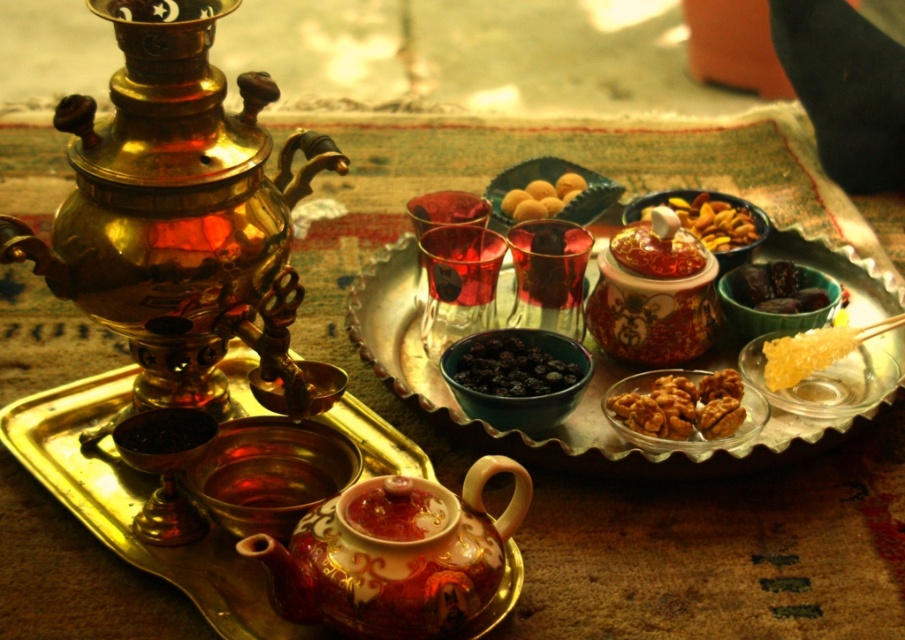
What object is located at the coordinate point (x=806, y=353) in the image?

The point (x=806, y=353) is on yellow crystalline sugar at right.

You are a guest at a tea ceremony and need to choose between the red glossy teapot at center and the blueberrysmoothfruit at center to place on a small shelf. Which one can fit better?

The blueberrysmoothfruit at center can fit better on the small shelf because it is smaller than the red glossy teapot at center.

You are a guest at a tea ceremony and need to reach for the yellow crystalline sugar at right. Considering your arm can extend 3 feet, can you grab it without moving your body?

The yellow crystalline sugar at right is 3.59 feet from camera, which is beyond your arm extension of 3 feet. You cannot reach it without moving your body.